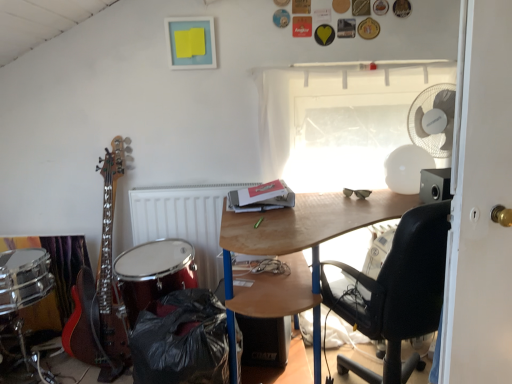
Locate an element on the screen. The height and width of the screenshot is (384, 512). vacant space in front of hardcover book at center is located at coordinates (276, 215).